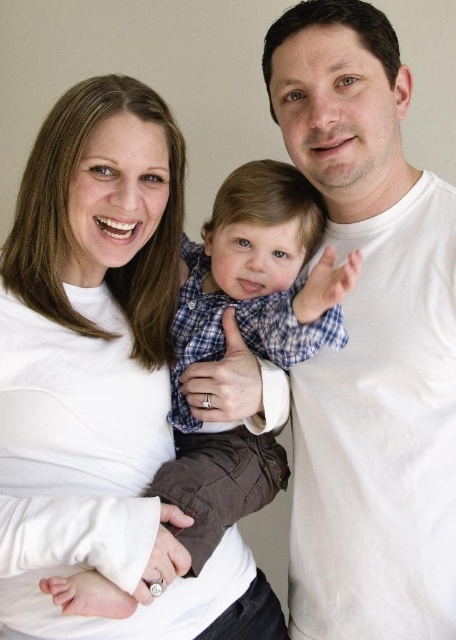
Question: Can you confirm if white cotton t-shirt at right is positioned to the left of blue plaid shirt at center?

Choices:
 (A) yes
 (B) no

Answer: (B)

Question: Which point is farther to the camera?

Choices:
 (A) white soft fabric at center
 (B) blue plaid shirt at center

Answer: (A)

Question: Is white cotton t-shirt at right thinner than white soft fabric at center?

Choices:
 (A) no
 (B) yes

Answer: (B)

Question: Which point is farther to the camera?

Choices:
 (A) pyautogui.click(x=404, y=449)
 (B) pyautogui.click(x=30, y=300)
 (C) pyautogui.click(x=267, y=451)

Answer: (C)

Question: Is white cotton t-shirt at right in front of blue plaid shirt at center?

Choices:
 (A) yes
 (B) no

Answer: (B)

Question: Which object is positioned closest to the white soft fabric at center?

Choices:
 (A) white cotton t-shirt at right
 (B) blue plaid shirt at center

Answer: (B)